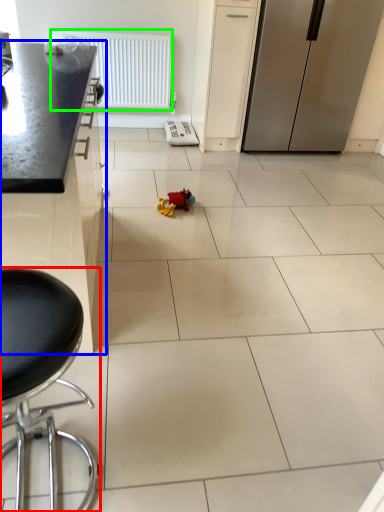
Question: Which is farther away from chair (highlighted by a red box)? cabinetry (highlighted by a blue box) or radiator (highlighted by a green box)?

Choices:
 (A) cabinetry
 (B) radiator

Answer: (B)